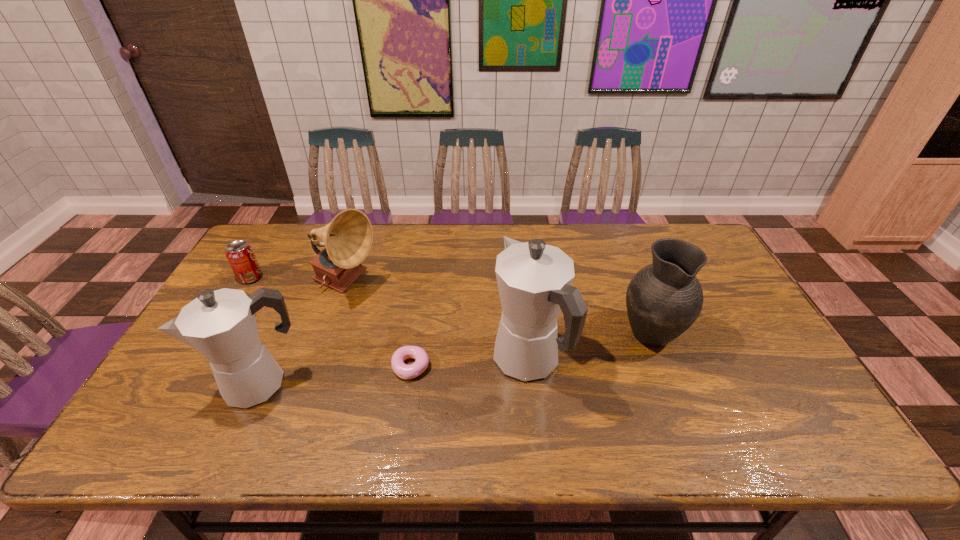
Locate an element on the screen. The image size is (960, 540). soda can located at the left edge is located at coordinates (240, 255).

Where is `object that is at the near left corner`? Image resolution: width=960 pixels, height=540 pixels. object that is at the near left corner is located at coordinates (221, 325).

The image size is (960, 540). Identify the location of vacant point at the far edge. (621, 237).

Locate an element on the screen. The image size is (960, 540). vacant space at the near edge is located at coordinates (405, 402).

The height and width of the screenshot is (540, 960). In the image, there is a desktop. Identify the location of vacant space at the left edge. (202, 364).

Locate an element on the screen. vacant region at the far left corner of the desktop is located at coordinates (286, 238).

Locate an element on the screen. This screenshot has height=540, width=960. free spot at the near left corner of the desktop is located at coordinates click(x=202, y=413).

In the image, there is a desktop. Identify the location of vacant space at the far right corner. (684, 240).

Image resolution: width=960 pixels, height=540 pixels. Find the location of `vacant space in between the phonograph record and the rightmost object`. vacant space in between the phonograph record and the rightmost object is located at coordinates (498, 308).

The image size is (960, 540). I want to click on free area in between the fourth object from left to right and the phonograph record, so click(x=378, y=326).